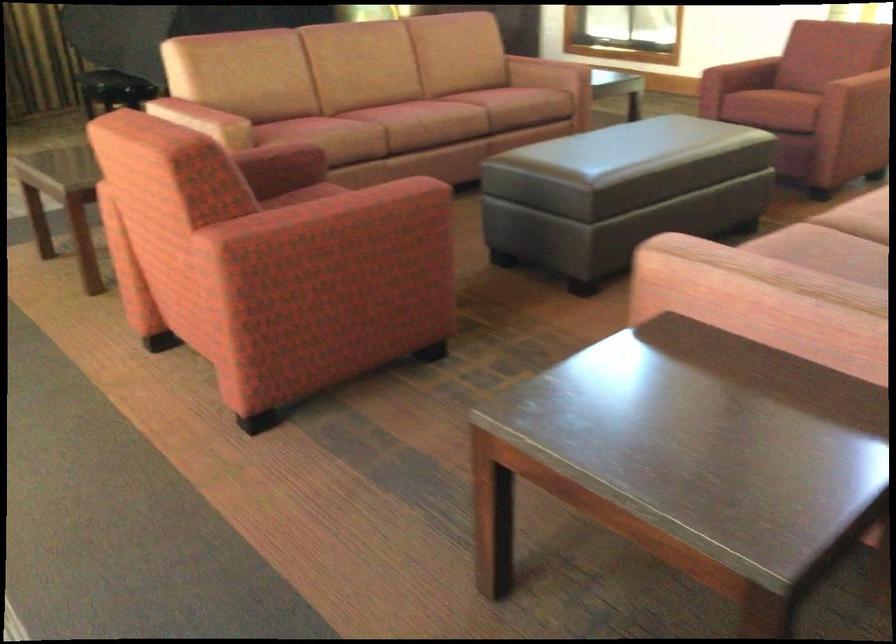
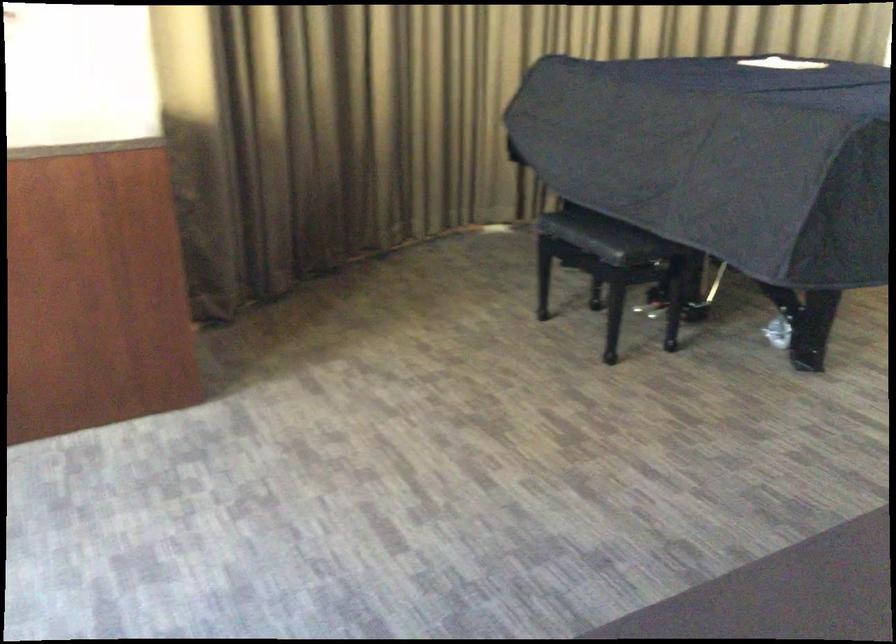
What movement of the cameraman would produce the second image?

The movement direction of the cameraman is left, forward.